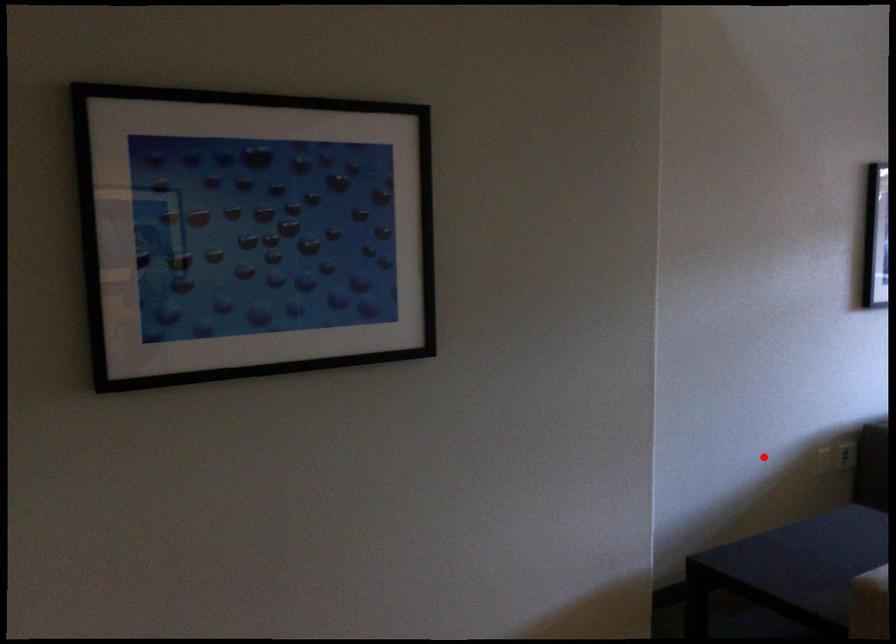
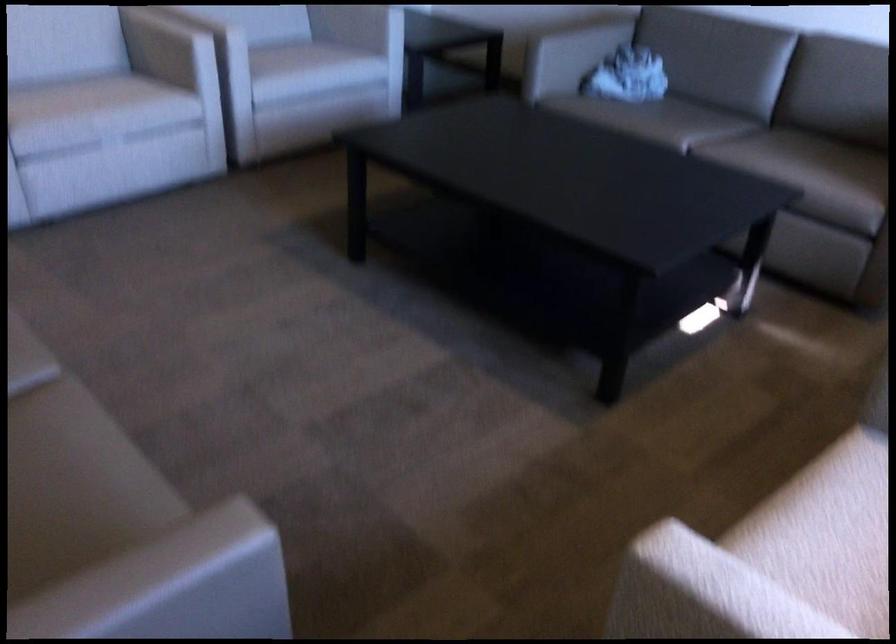
Question: I am providing you with two images of the same scene from different viewpoints. Given a red point in image1, look at the same physical point in image2. Is it:

Choices:
 (A) Closer to the viewpoint
 (B) Farther from the viewpoint

Answer: (B)